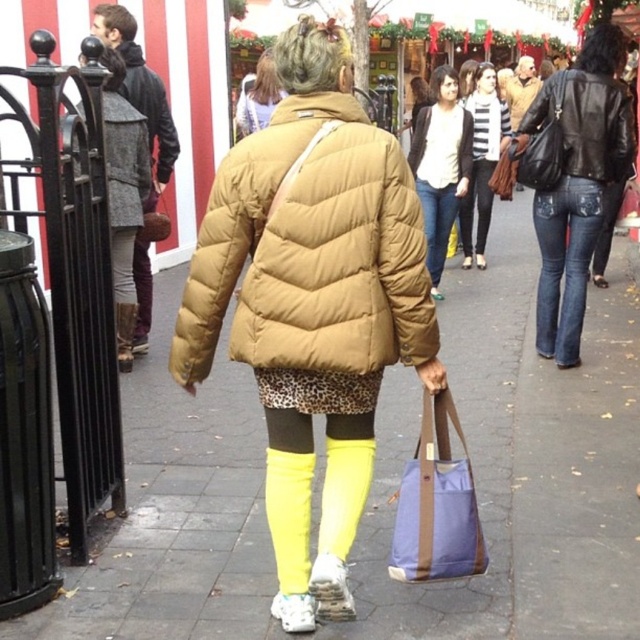
Question: Can you confirm if striped sweater at center is positioned below brown quilted coat at upper center?

Choices:
 (A) yes
 (B) no

Answer: (B)

Question: Is matte concrete pavement at center below leather boots at left?

Choices:
 (A) yes
 (B) no

Answer: (A)

Question: Based on their relative distances, which object is farther from the yellow rubber rain boot at left?

Choices:
 (A) gray wool coat at left
 (B) matte yellow leggings at center

Answer: (B)

Question: Is black leather jacket at upper right above jeans at center?

Choices:
 (A) yes
 (B) no

Answer: (A)

Question: Which point is closer to the camera taking this photo?

Choices:
 (A) (420, 180)
 (B) (120, 120)
 (C) (122, 349)
 (D) (572, 216)

Answer: (B)

Question: Which point appears farthest from the camera in this image?

Choices:
 (A) (502, 116)
 (B) (280, 228)
 (C) (589, 259)

Answer: (A)